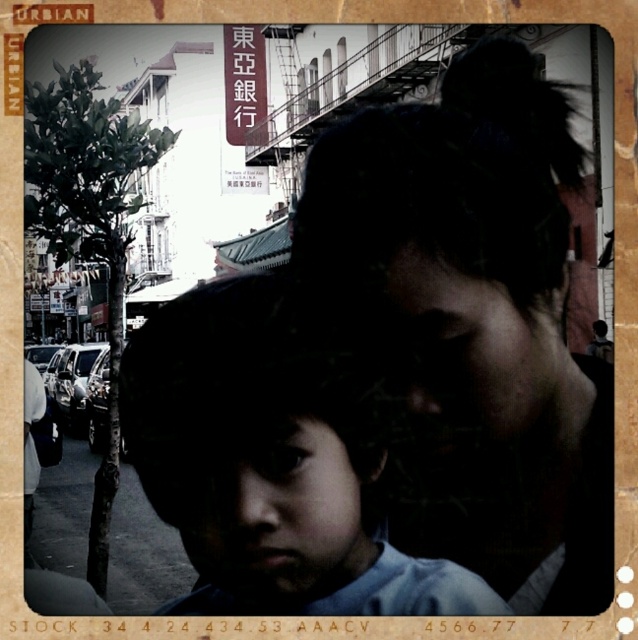
Is matte black hair at center above smooth skin child at center?

Indeed, matte black hair at center is positioned over smooth skin child at center.

The width and height of the screenshot is (638, 640). What are the coordinates of `matte black hair at center` in the screenshot? It's located at (473, 314).